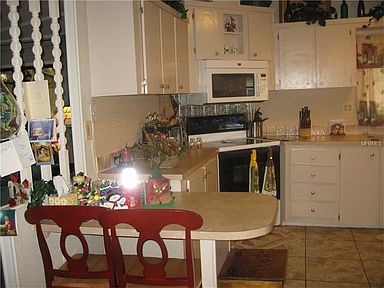
At what (x,y) coordinates should I click in order to perform the action: click on beige mat. Please return your answer as a coordinate pair (x, y). Looking at the image, I should click on (277, 240).